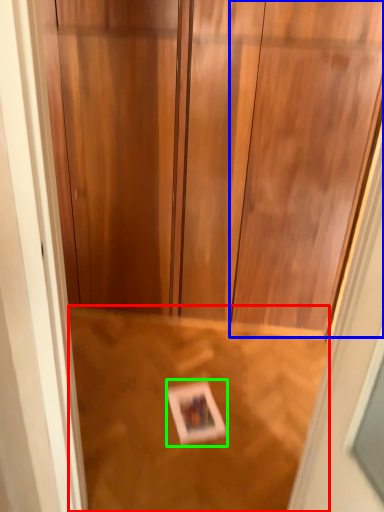
Question: Which object is positioned farthest from plywood (highlighted by a red box)? Select from door (highlighted by a blue box) and postcard (highlighted by a green box).

Choices:
 (A) door
 (B) postcard

Answer: (A)